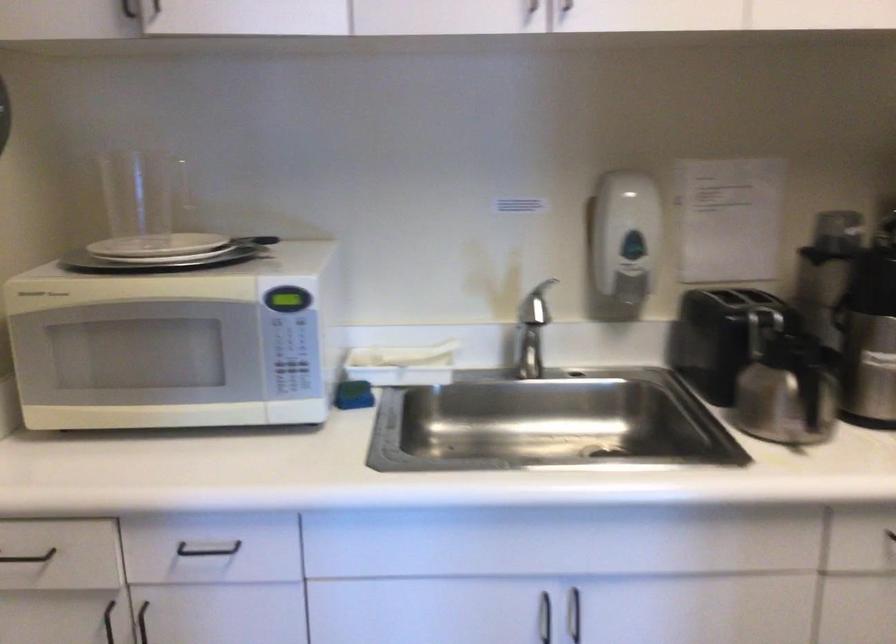
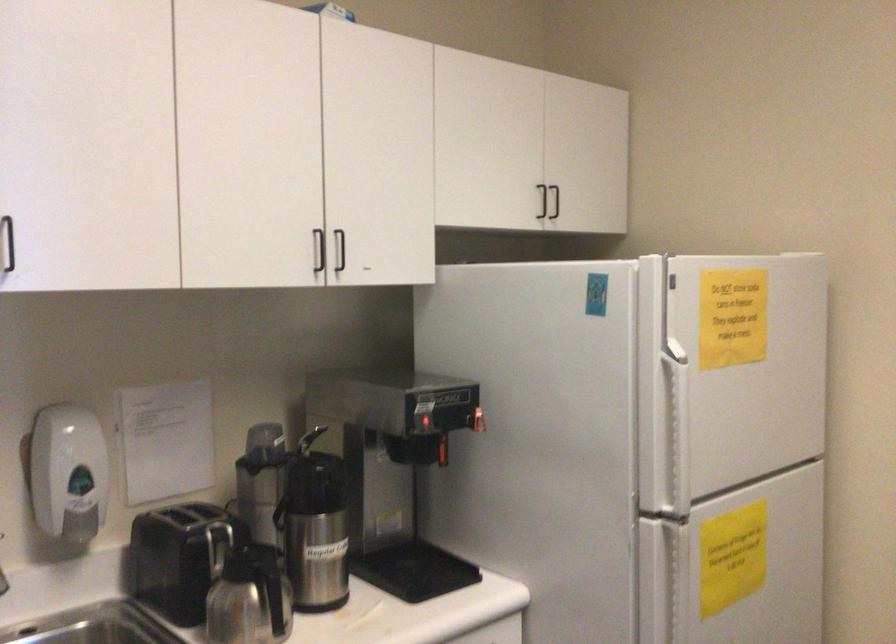
Find the pixel in the second image that matches point 618,234 in the first image.

(67, 473)